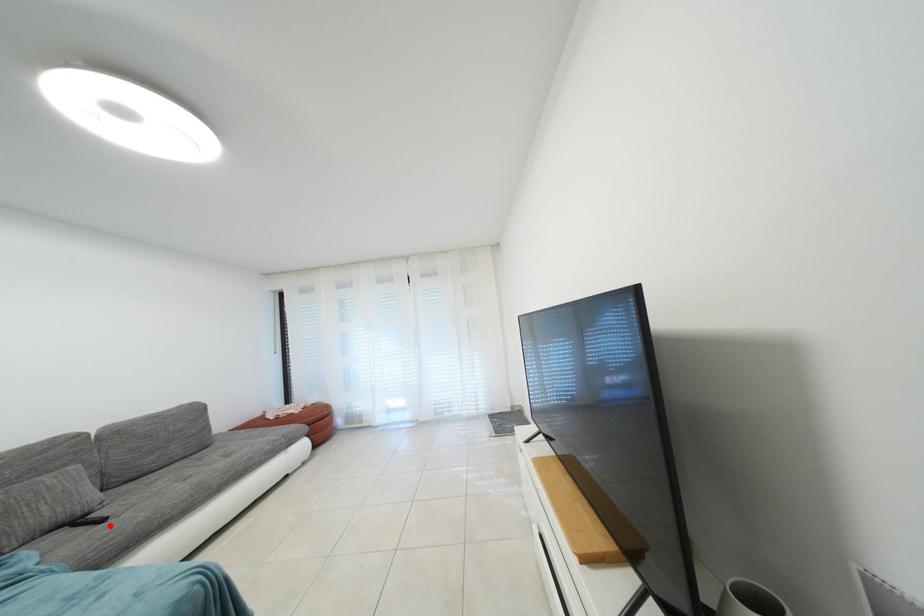
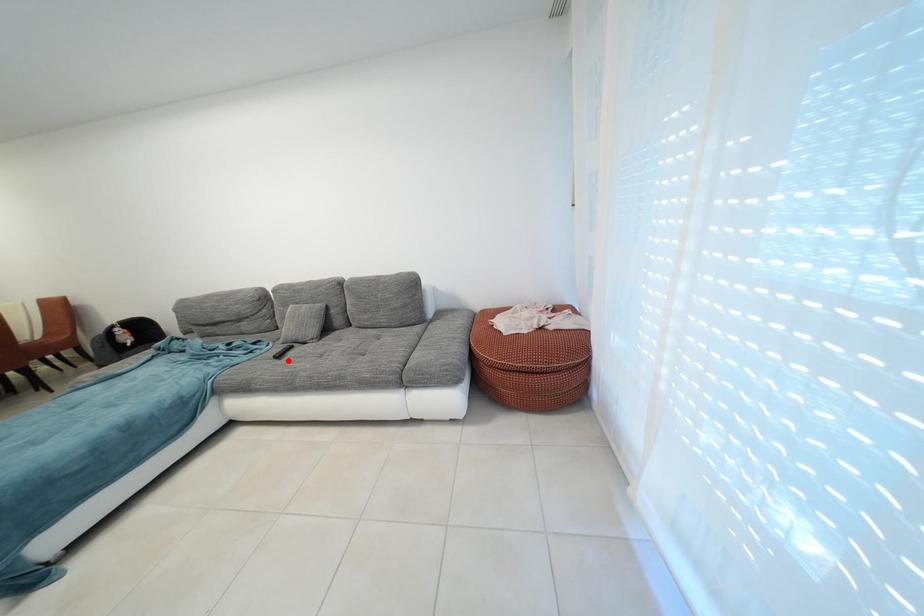
I am providing you with two images of the same scene from different viewpoints. A red point is marked on the first image and another point is marked on the second image. Do the highlighted points in image1 and image2 indicate the same real-world spot?

Yes